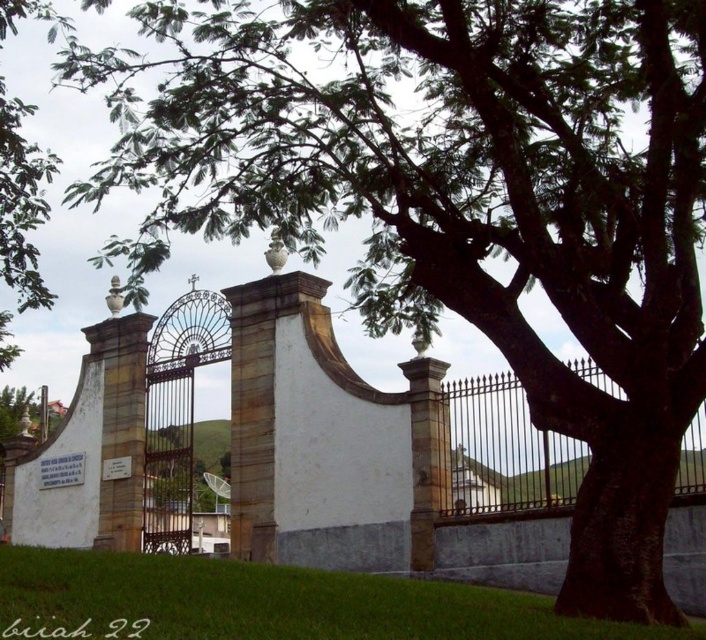
You are standing at the center of the image and want to walk towards the green grass at lower left. In which direction should you move?

The green grass at lower left is located at point (268, 602), so you should move towards the lower left direction to reach it.